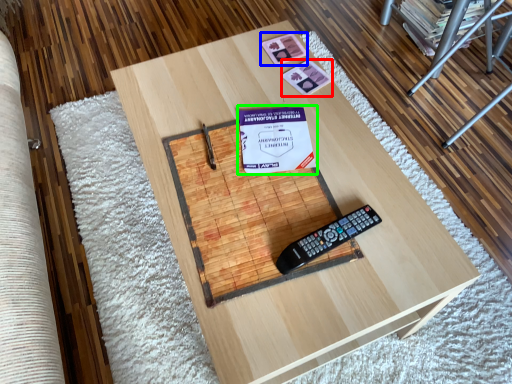
Question: Which is nearer to the square (highlighted by a red box)? square (highlighted by a blue box) or paperback book (highlighted by a green box).

Choices:
 (A) square
 (B) paperback book

Answer: (A)